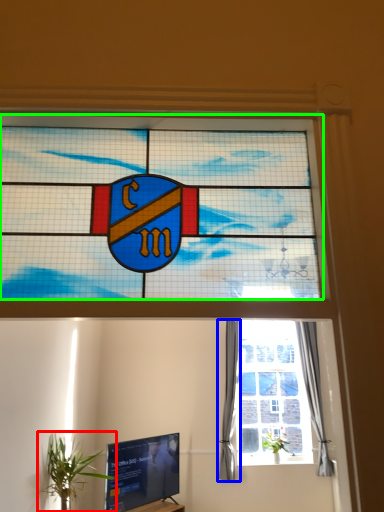
Question: Which is farther away from houseplant (highlighted by a red box)? curtain (highlighted by a blue box) or window (highlighted by a green box)?

Choices:
 (A) curtain
 (B) window

Answer: (B)